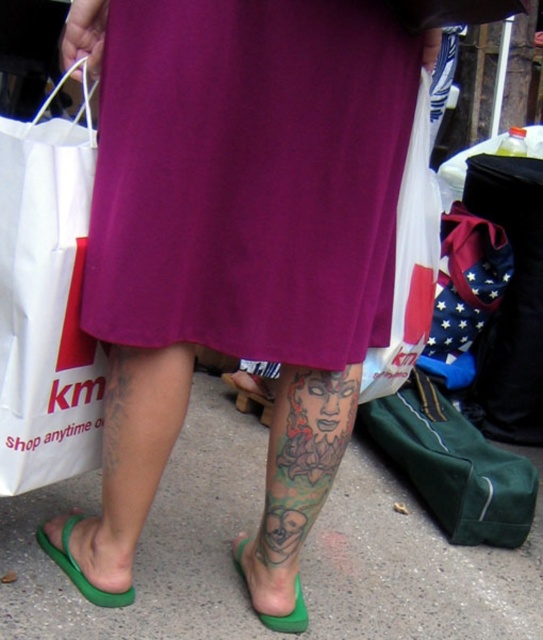
Does green fabric bag at lower right lie in front of green rubber flip-flop at lower left?

No, green fabric bag at lower right is behind green rubber flip-flop at lower left.

What do you see at coordinates (452, 465) in the screenshot? Image resolution: width=543 pixels, height=640 pixels. I see `green fabric bag at lower right` at bounding box center [452, 465].

Locate an element on the screen. Image resolution: width=543 pixels, height=640 pixels. green fabric bag at lower right is located at coordinates (452, 465).

In order to click on green fabric bag at lower right in this screenshot , I will do `click(452, 465)`.

Who is more forward, (80, 381) or (43, 544)?

Point (80, 381) is more forward.

Can you confirm if white paper bag at left is shorter than green rubber flip-flop at lower left?

No.

Who is more distant from viewer, (x=2, y=305) or (x=129, y=593)?

The point (x=129, y=593) is more distant.

Where is `white paper bag at left`? This screenshot has height=640, width=543. white paper bag at left is located at coordinates (47, 300).

Does green rubber flip-flops at lower center have a lesser height compared to green fabric bag at lower right?

No.

Is point (390, 608) in front of point (535, 490)?

Yes, point (390, 608) is closer to viewer.

Which is behind, point (407, 532) or point (460, 513)?

Point (407, 532)

Where is `green rubber flip-flops at lower center`? Image resolution: width=543 pixels, height=640 pixels. green rubber flip-flops at lower center is located at coordinates (252, 531).